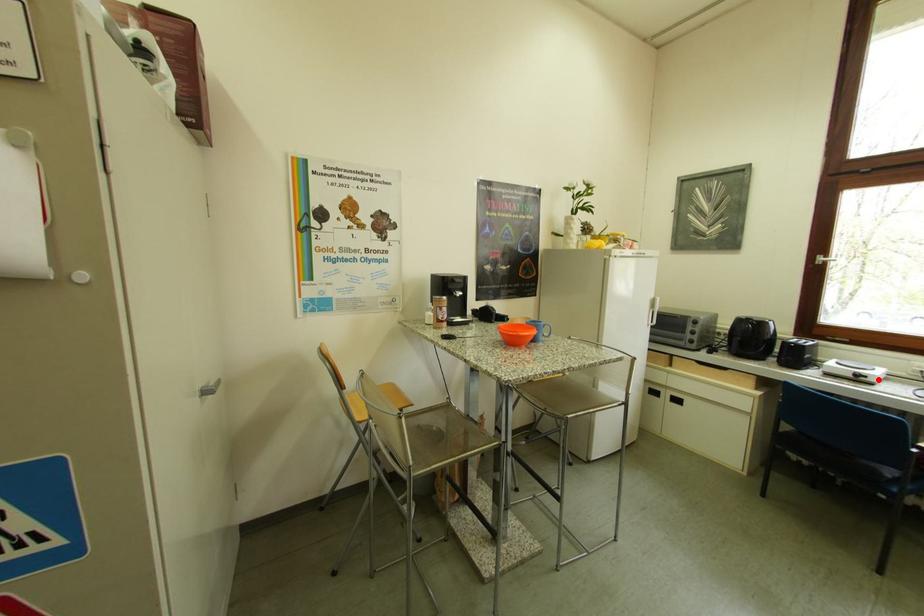
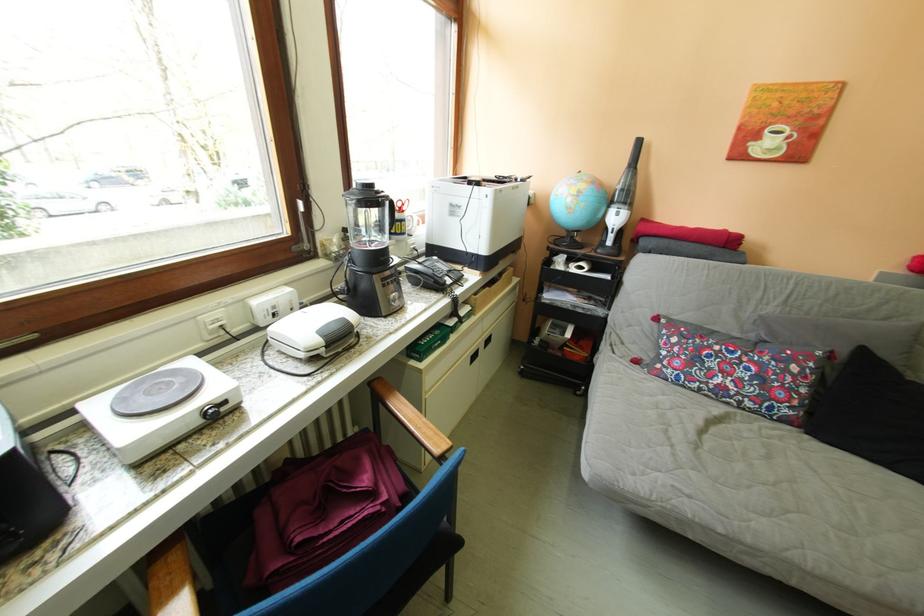
Find the pixel in the second image that matches the highlighted location in the first image.

(237, 406)